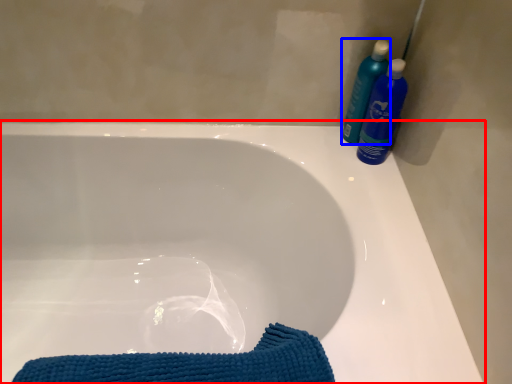
Question: Which point is closer to the camera, bathtub (highlighted by a red box) or cleaning product (highlighted by a blue box)?

Choices:
 (A) bathtub
 (B) cleaning product

Answer: (A)